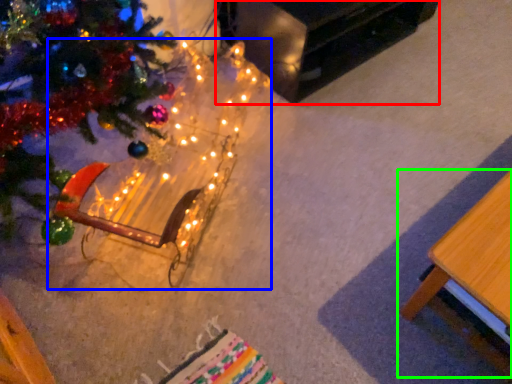
Question: Which object is the farthest from table (highlighted by a red box)? Choose among these: christmas decoration (highlighted by a blue box) or table (highlighted by a green box).

Choices:
 (A) christmas decoration
 (B) table

Answer: (B)